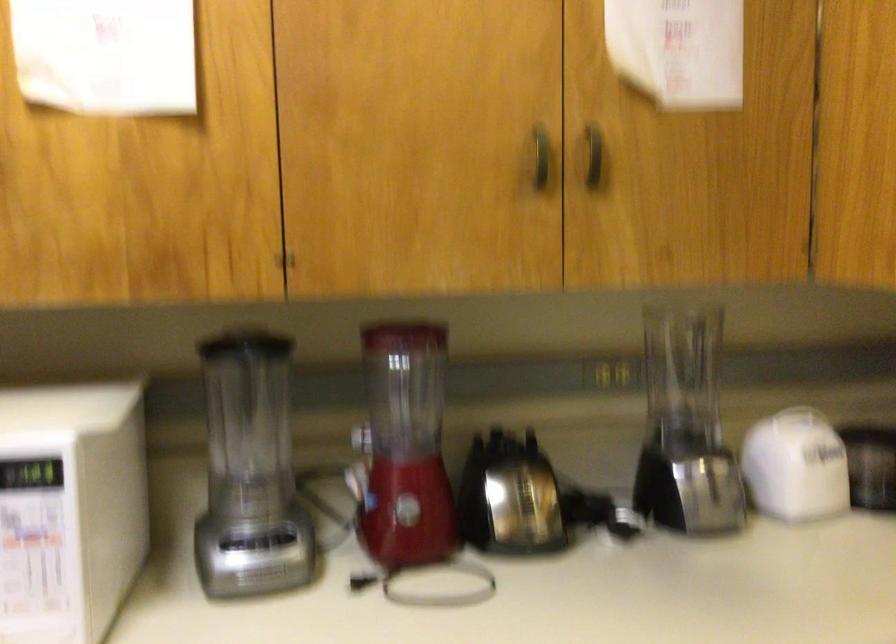
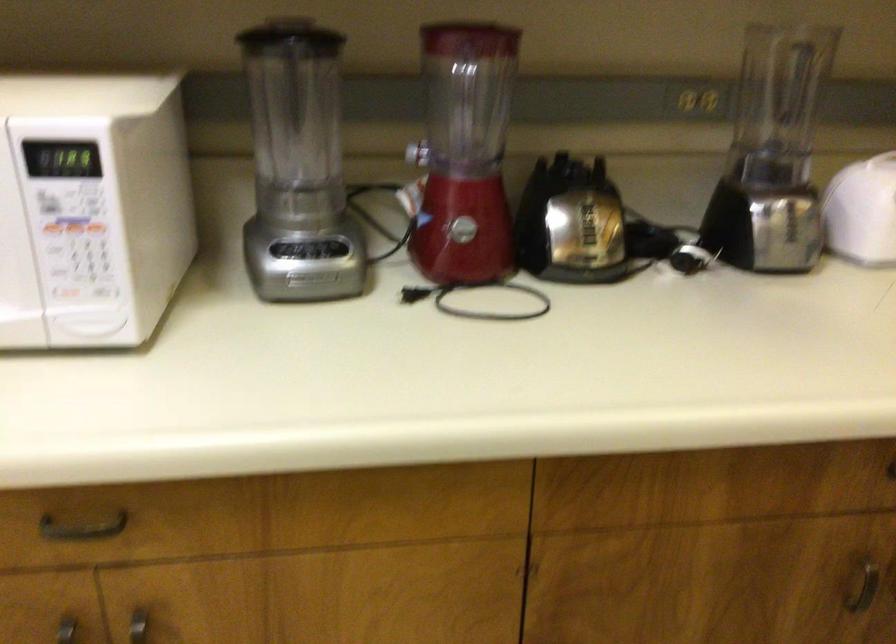
Where in the second image is the point corresponding to (x=261, y=544) from the first image?

(308, 249)